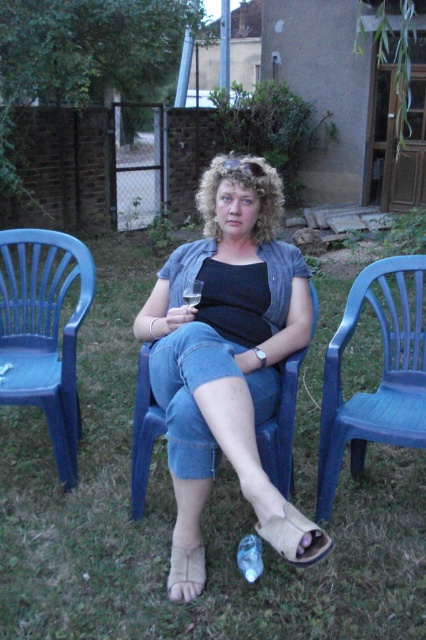
Is blue plastic chair at right below leather sandal at lower center?

Actually, blue plastic chair at right is above leather sandal at lower center.

Based on the photo, which is more to the left, blue plastic chair at right or leather sandal at lower center?

From the viewer's perspective, leather sandal at lower center appears more on the left side.

Is point (348, 320) more distant than point (276, 529)?

Yes.

The width and height of the screenshot is (426, 640). I want to click on blue plastic chair at right, so click(380, 380).

Between green grass at center and denim shorts at center, which one appears on the left side from the viewer's perspective?

green grass at center is more to the left.

This screenshot has height=640, width=426. Describe the element at coordinates (173, 518) in the screenshot. I see `green grass at center` at that location.

Image resolution: width=426 pixels, height=640 pixels. I want to click on green grass at center, so click(173, 518).

Identify the location of green grass at center. Image resolution: width=426 pixels, height=640 pixels. (173, 518).

Is blue plastic chair at right taller than beige fabric sandal at lower center?

Yes.

Between point (422, 368) and point (172, 563), which one is positioned behind?

Point (422, 368)

Identify the location of blue plastic chair at right. (380, 380).